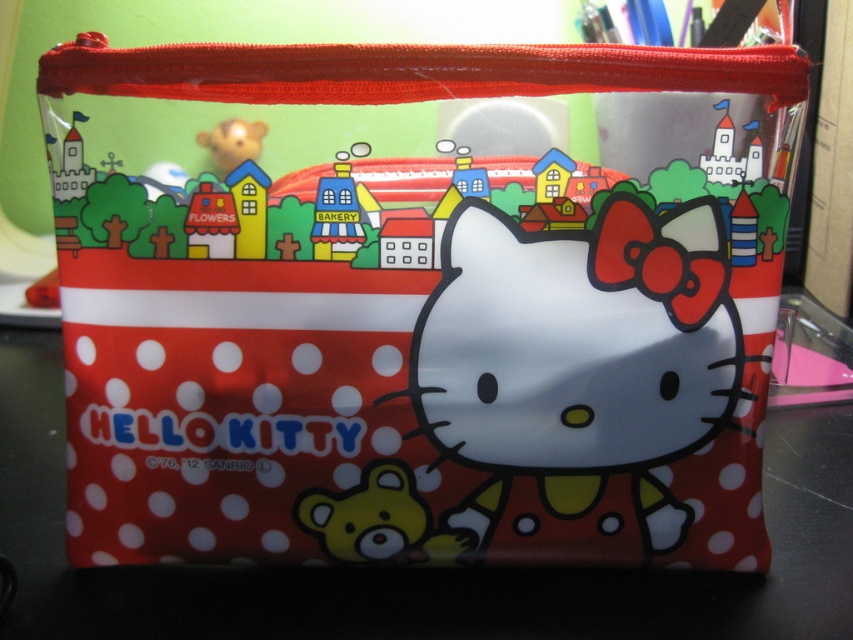
Who is taller, yellow matte bear at center or matte yellow house at center?

With more height is yellow matte bear at center.

Can you confirm if yellow matte bear at center is smaller than matte yellow house at center?

Incorrect, yellow matte bear at center is not smaller in size than matte yellow house at center.

Which is behind, point (312, 492) or point (566, 209)?

Positioned behind is point (312, 492).

Where is `yellow matte bear at center`? Image resolution: width=853 pixels, height=640 pixels. yellow matte bear at center is located at coordinates (386, 520).

Which is above, yellow matte bear at center or matte yellow bear at center?

Positioned higher is matte yellow bear at center.

Where is `yellow matte bear at center`? The image size is (853, 640). yellow matte bear at center is located at coordinates (386, 520).

Locate an element on the screen. Image resolution: width=853 pixels, height=640 pixels. yellow matte bear at center is located at coordinates (386, 520).

The image size is (853, 640). I want to click on yellow matte bear at center, so click(386, 520).

Can you confirm if matte yellow house at center is positioned to the right of matte yellow bear at center?

Indeed, matte yellow house at center is positioned on the right side of matte yellow bear at center.

Who is taller, matte yellow house at center or matte yellow bear at center?

With more height is matte yellow house at center.

What do you see at coordinates (552, 195) in the screenshot?
I see `matte yellow house at center` at bounding box center [552, 195].

Where is `matte yellow house at center`? The width and height of the screenshot is (853, 640). matte yellow house at center is located at coordinates (552, 195).